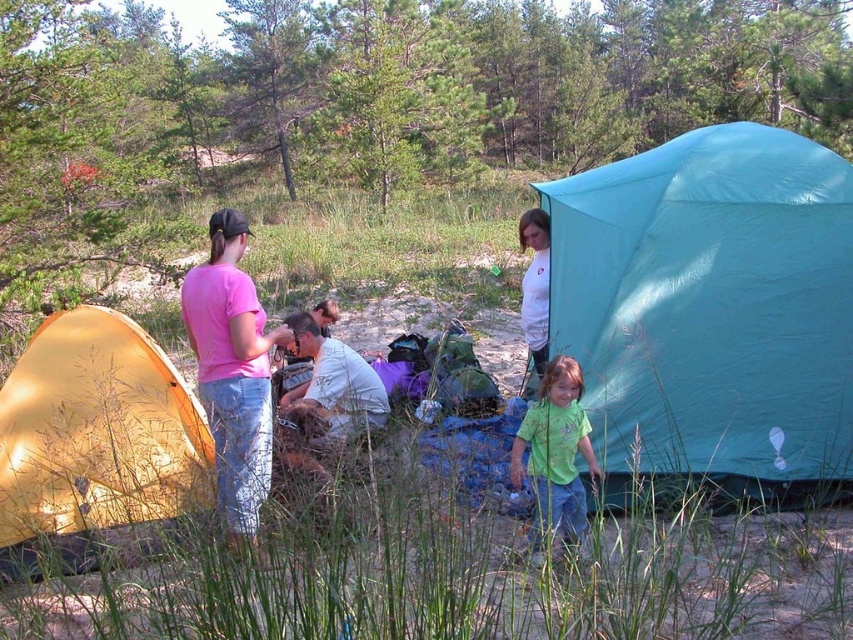
You are a hiker who wants to set up a tent. You see the teal fabric tent at right and the white cotton shirt at center. Which object is higher up in the image?

The teal fabric tent at right is located above the white cotton shirt at center, so the teal fabric tent at right is higher up in the image.

You are a hiker who just arrived at the campsite. You see the teal fabric tent at right and the white cotton shirt at upper center. Which object is taller?

The teal fabric tent at right is taller than the white cotton shirt at upper center.